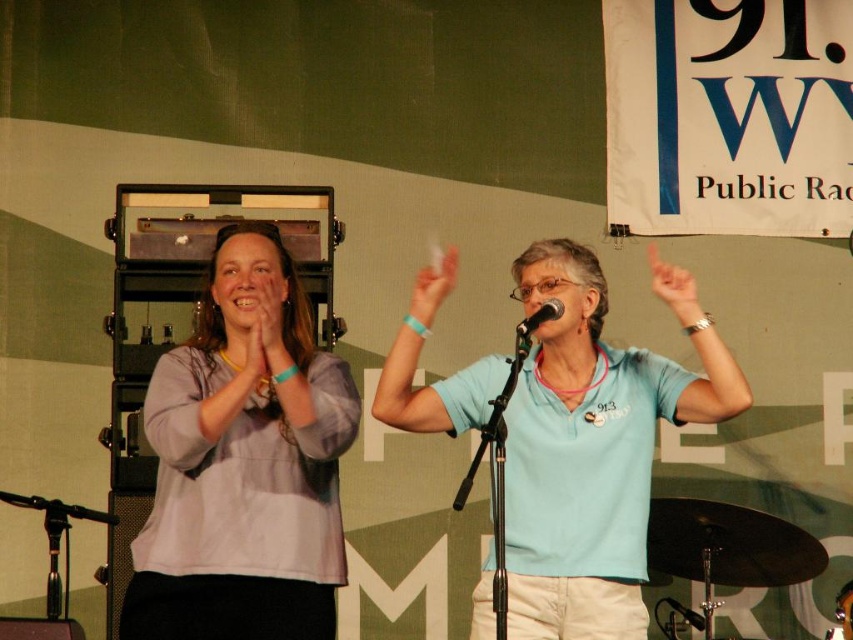
You are attending a live event and see the light gray cotton shirt at center and the black matte microphone at center. Which object is positioned higher in the image?

The light gray cotton shirt at center is much taller than the black matte microphone at center, so it is positioned higher in the image.

You are a photographer at the event and want to ensure both the light gray cotton shirt at center and the light blue fabric shirt at center are clearly visible in your photo. Given their height difference, which one might you need to adjust your camera angle for to capture both effectively?

The light gray cotton shirt at center is much taller than the light blue fabric shirt at center. To capture both effectively, you might need to lower your camera angle slightly to ensure the shorter light blue fabric shirt at center is visible above the taller light gray cotton shirt at center.

You are standing in the center of the image and want to move towards the white matte hand at center. In which direction should you move?

Since the white matte hand at center is already at the center of the image, you don not need to move in any direction. You are already facing it.